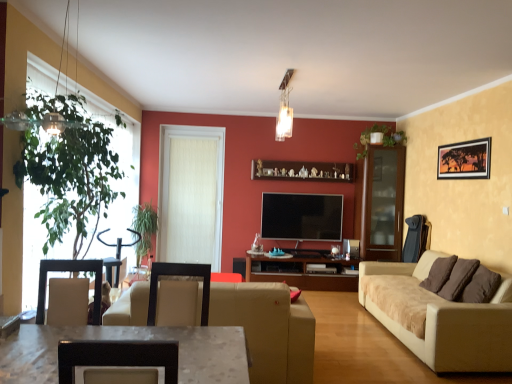
Question: Relative to white marble table at lower left, is beige leather couch at center, the second studio couch positioned from the right, in front or behind?

Choices:
 (A) behind
 (B) front

Answer: (A)

Question: From the image's perspective, is beige leather couch at center, the second studio couch positioned from the right, positioned above or below white marble table at lower left?

Choices:
 (A) above
 (B) below

Answer: (B)

Question: Considering the real-world distances, which object is closest to the green leafy plant at upper center, placed as the 2th plant when sorted from left to right?

Choices:
 (A) green leafy plant at left
 (B) flat screen tv at center
 (C) white textured door at center
 (D) beige leather couch at center, the second studio couch positioned from the right
 (E) metallic glass light fixture at upper center

Answer: (B)

Question: Which object is the farthest from the metallic glass light fixture at upper center?

Choices:
 (A) flat screen tv at center
 (B) beige leather couch at center, marked as the first studio couch in a left-to-right arrangement
 (C) white marble table at lower left
 (D) green leafy plant at left
 (E) beige suede sofa at right, placed as the first studio couch when sorted from right to left

Answer: (C)